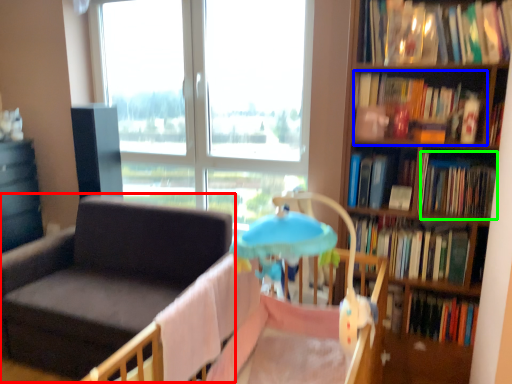
Question: Estimate the real-world distances between objects in this image. Which object is closer to chair (highlighted by a red box), book (highlighted by a blue box) or book (highlighted by a green box)?

Choices:
 (A) book
 (B) book

Answer: (A)